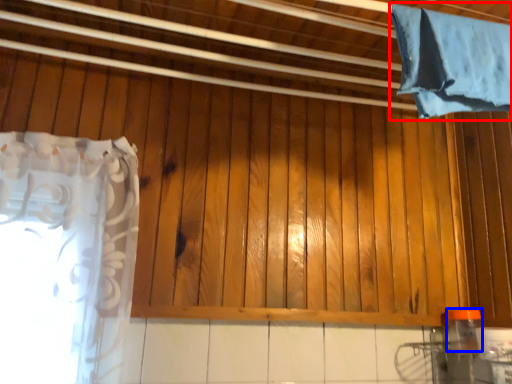
Question: Which point is closer to the camera, curtain (highlighted by a red box) or bottle (highlighted by a blue box)?

Choices:
 (A) curtain
 (B) bottle

Answer: (A)